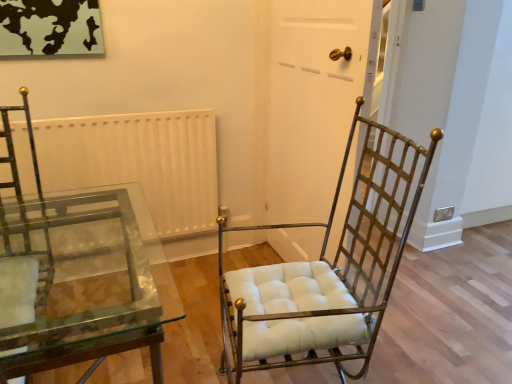
Locate an element on the screen. white matte radiator at upper center is located at coordinates point(138,161).

What do you see at coordinates (312, 102) in the screenshot?
I see `white matte door at center` at bounding box center [312, 102].

Locate an element on the screen. This screenshot has height=384, width=512. transparent glass table at lower left is located at coordinates (85, 282).

This screenshot has height=384, width=512. I want to click on white matte radiator at upper center, so click(138, 161).

From a real-world perspective, is white matte radiator at upper center below gold metal/texture chair at center?

Yes.

Is point (116, 164) in front of point (378, 277)?

No, (116, 164) is further to viewer.

Between white matte radiator at upper center and gold metal/texture chair at center, which one appears on the left side from the viewer's perspective?

From the viewer's perspective, white matte radiator at upper center appears more on the left side.

From the picture: Is white matte radiator at upper center inside the boundaries of gold metal/texture chair at center, or outside?

white matte radiator at upper center is not inside gold metal/texture chair at center, it's outside.

In terms of width, does white matte door at center look wider or thinner when compared to transparent glass table at lower left?

white matte door at center is thinner than transparent glass table at lower left.

Does white matte door at center have a smaller size compared to transparent glass table at lower left?

Yes, white matte door at center is smaller than transparent glass table at lower left.

Is white matte door at center not close to transparent glass table at lower left?

They are positioned close to each other.

Is white matte door at center inside or outside of transparent glass table at lower left?

white matte door at center is not enclosed by transparent glass table at lower left.

Find the location of a particular element. The image size is (512, 384). glass door above the transparent glass table at lower left (from the image's perspective) is located at coordinates (312, 102).

Is white matte door at center a part of transparent glass table at lower left?

No, white matte door at center is not a part of transparent glass table at lower left.

Based on the photo, are transparent glass table at lower left and white matte door at center making contact?

No, transparent glass table at lower left is not making contact with white matte door at center.

Considering the relative sizes of transparent glass table at lower left and white matte door at center in the image provided, is transparent glass table at lower left taller than white matte door at center?

In fact, transparent glass table at lower left may be shorter than white matte door at center.

The height and width of the screenshot is (384, 512). I want to click on radiator below the gold metal/texture chair at center (from a real-world perspective), so click(x=138, y=161).

Does point (307, 357) lie in front of point (212, 226)?

That is True.

From the image's perspective, which is below, gold metal/texture chair at center or white matte radiator at upper center?

gold metal/texture chair at center.

Is gold metal/texture chair at center to the right of white matte radiator at upper center from the viewer's perspective?

Indeed, gold metal/texture chair at center is positioned on the right side of white matte radiator at upper center.

Is transparent glass table at lower left shorter than white matte radiator at upper center?

No.

Considering their positions, is transparent glass table at lower left located in front of or behind white matte radiator at upper center?

transparent glass table at lower left is positioned closer to the viewer than white matte radiator at upper center.

Which object is wider, transparent glass table at lower left or white matte radiator at upper center?

Wider between the two is transparent glass table at lower left.

Based on the photo, measure the distance from white matte radiator at upper center to white matte door at center.

They are 26.64 inches apart.

Is white matte radiator at upper center positioned before white matte door at center?

That is False.

Is white matte door at center at the back of white matte radiator at upper center?

No, white matte radiator at upper center's orientation is not away from white matte door at center.

From the image's perspective, relative to white matte door at center, is white matte radiator at upper center above or below?

Based on their image positions, white matte radiator at upper center is located beneath white matte door at center.

From the image's perspective, does white matte door at center appear higher than white matte radiator at upper center?

Yes, from the image's perspective, white matte door at center is above white matte radiator at upper center.

Is white matte radiator at upper center inside white matte door at center?

No, white matte door at center does not contain white matte radiator at upper center.

In the scene shown: Is white matte door at center at the left side of white matte radiator at upper center?

No, white matte door at center is not to the left of white matte radiator at upper center.

Find the location of `radiator below the white matte door at center (from a real-world perspective)`. radiator below the white matte door at center (from a real-world perspective) is located at coordinates (138, 161).

You are a GUI agent. You are given a task and a screenshot of the screen. Output one action in this format:
    pyautogui.click(x=<x>, y=<y>)
    Task: Click on the radiator above the gold metal/texture chair at center (from the image's perspective)
    
    Given the screenshot: What is the action you would take?
    pyautogui.click(x=138, y=161)

Locate an element on the screen. The image size is (512, 384). table in front of the white matte door at center is located at coordinates (85, 282).

Considering their positions, is transparent glass table at lower left positioned closer to white matte radiator at upper center than white matte door at center?

transparent glass table at lower left lies closer to white matte radiator at upper center than the other object.

Looking at the image, which one is located closer to white matte door at center, gold metal/texture chair at center or transparent glass table at lower left?

gold metal/texture chair at center is positioned closer to the anchor white matte door at center.

Looking at the image, which one is located further to transparent glass table at lower left, white matte door at center or gold metal/texture chair at center?

Among the two, gold metal/texture chair at center is located further to transparent glass table at lower left.

Looking at the image, which one is located further to gold metal/texture chair at center, white matte door at center or transparent glass table at lower left?

transparent glass table at lower left lies further to gold metal/texture chair at center than the other object.

Looking at the image, which one is located further to white matte radiator at upper center, transparent glass table at lower left or gold metal/texture chair at center?

gold metal/texture chair at center is positioned further to the anchor white matte radiator at upper center.

From the picture: From the image, which object appears to be nearer to gold metal/texture chair at center, transparent glass table at lower left or white matte radiator at upper center?

The object closer to gold metal/texture chair at center is white matte radiator at upper center.

Which object lies nearer to the anchor point white matte door at center, white matte radiator at upper center or transparent glass table at lower left?

Among the two, white matte radiator at upper center is located nearer to white matte door at center.

When comparing their distances from transparent glass table at lower left, does white matte radiator at upper center or gold metal/texture chair at center seem closer?

white matte radiator at upper center lies closer to transparent glass table at lower left than the other object.

Identify the location of glass door between transparent glass table at lower left and white matte radiator at upper center in the front-back direction. (312, 102).

Find the location of `chair located between white matte radiator at upper center and white matte door at center in the left-right direction`. chair located between white matte radiator at upper center and white matte door at center in the left-right direction is located at coordinates (333, 272).

I want to click on chair between transparent glass table at lower left and white matte radiator at upper center along the z-axis, so click(x=333, y=272).

This screenshot has width=512, height=384. Identify the location of chair that lies between white matte door at center and transparent glass table at lower left from top to bottom. (333, 272).